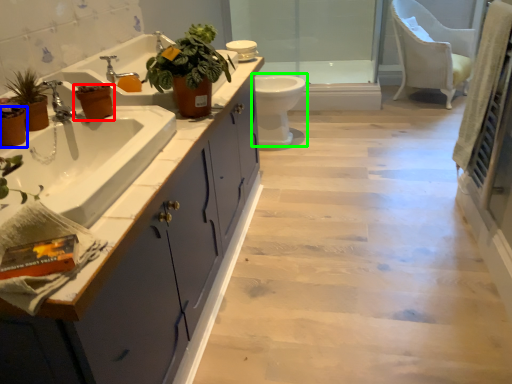
Question: Which object is positioned farthest from flowerpot (highlighted by a red box)? Select from flowerpot (highlighted by a blue box) and toilet (highlighted by a green box).

Choices:
 (A) flowerpot
 (B) toilet

Answer: (B)